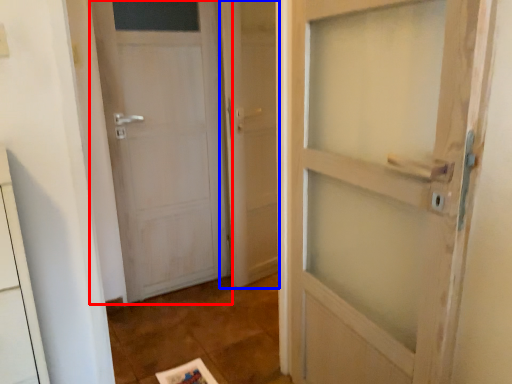
Question: Which of the following is the farthest to the observer, door (highlighted by a red box) or screen door (highlighted by a blue box)?

Choices:
 (A) door
 (B) screen door

Answer: (B)